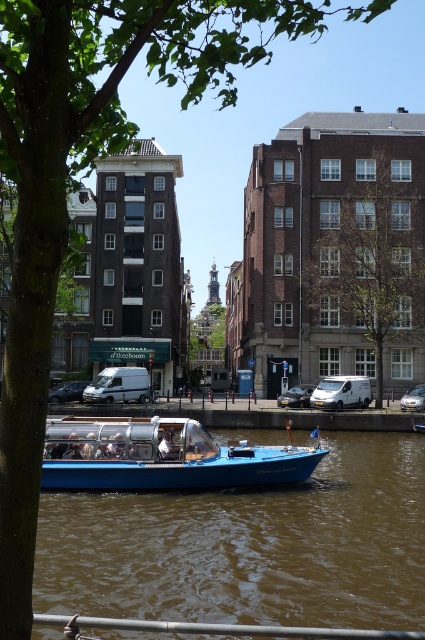
You are standing at the edge of the canal and want to reach a specific point marked as point (323, 298). Given that the average walking speed is 3 miles per hour, how long would it take you to walk to that point?

The point (323, 298) is 334.06 feet away from the viewer. Converting feet to miles, 334.06 feet is approximately 0.063 miles. At a walking speed of 3 mph, the time required would be distance divided by speed, so 0.063 miles divided by 3 mph equals approximately 0.021 hours. Converting hours to minutes, this is roughly 1.26 minutes, so about 1 minute and 15 seconds.

You are standing at the camera position observing the scene. You want to take a photo of the blue plastic boat at lower center. Given that your camera has a maximum zoom range of 30 meters, can you capture the boat clearly without moving closer?

The blue plastic boat at lower center and camera are 44.24 meters apart from each other. Since the maximum zoom range of your camera is 30 meters, you cannot capture the boat clearly without moving closer.

You are standing at the point with coordinates 0.5, 0.5 in the image. You want to walk towards the green leafy tree at center. Which direction should you move?

A: The green leafy tree at center is located at point (x=365, y=262). Since your current position is at (x=212, y=320), you should move towards the direction of lower x and higher y coordinates to reach the green leafy tree at center.